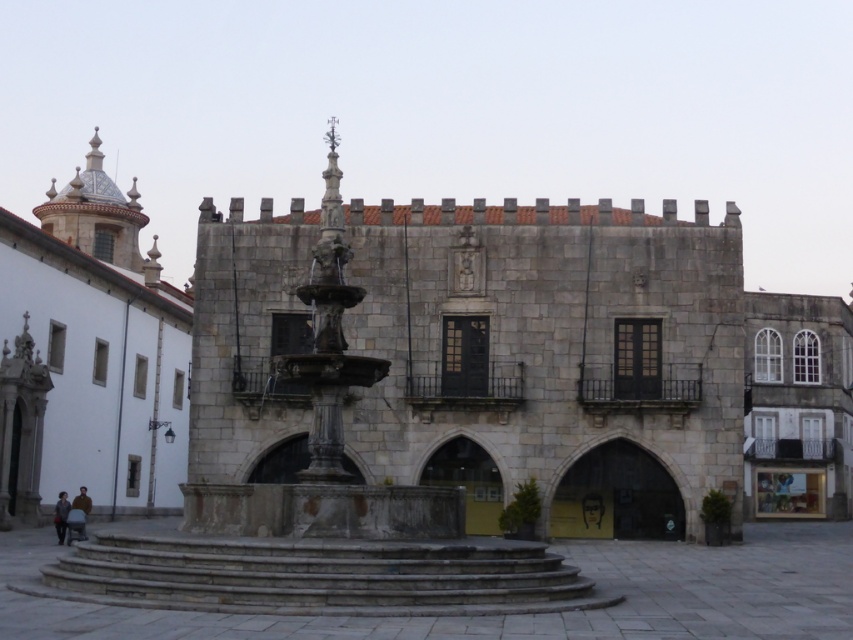
You are standing in front of the historical stone building and notice two points marked on the building facade. The first point is at coordinates point (79, 536) and the second is at point (62, 531). From your perspective, which point is closer to you?

Point (79, 536) is in front of point (62, 531), so it is closer to you.